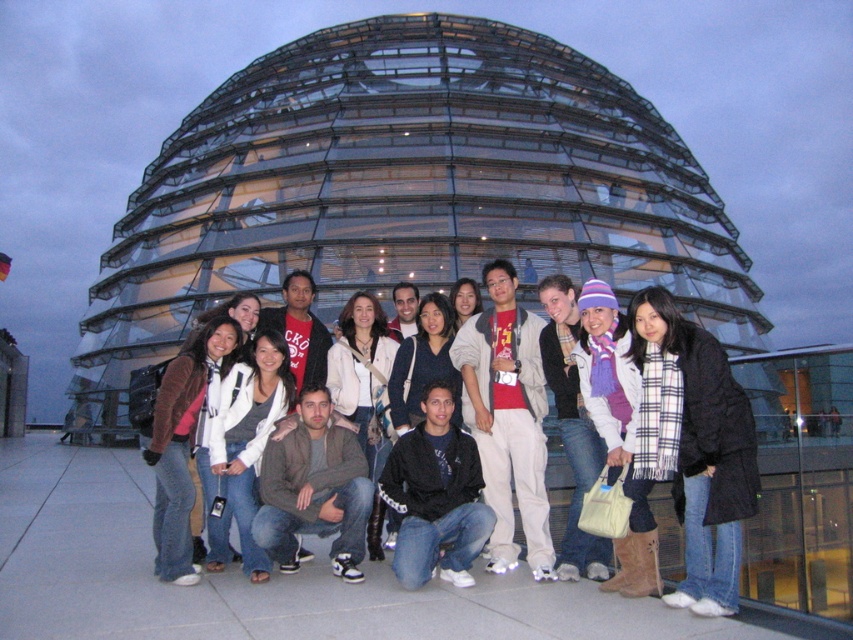
Which of these two, light gray cotton jacket at center or white knit sweater at center, stands shorter?

white knit sweater at center

Does light gray cotton jacket at center have a lesser height compared to white knit sweater at center?

No.

Find the location of a particular element. This screenshot has height=640, width=853. light gray cotton jacket at center is located at coordinates (508, 419).

I want to click on light gray cotton jacket at center, so click(508, 419).